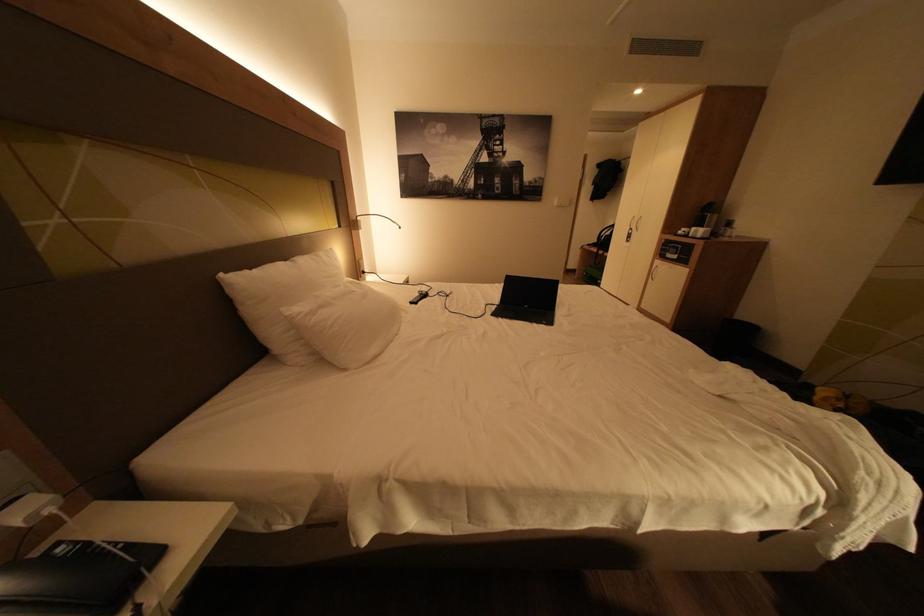
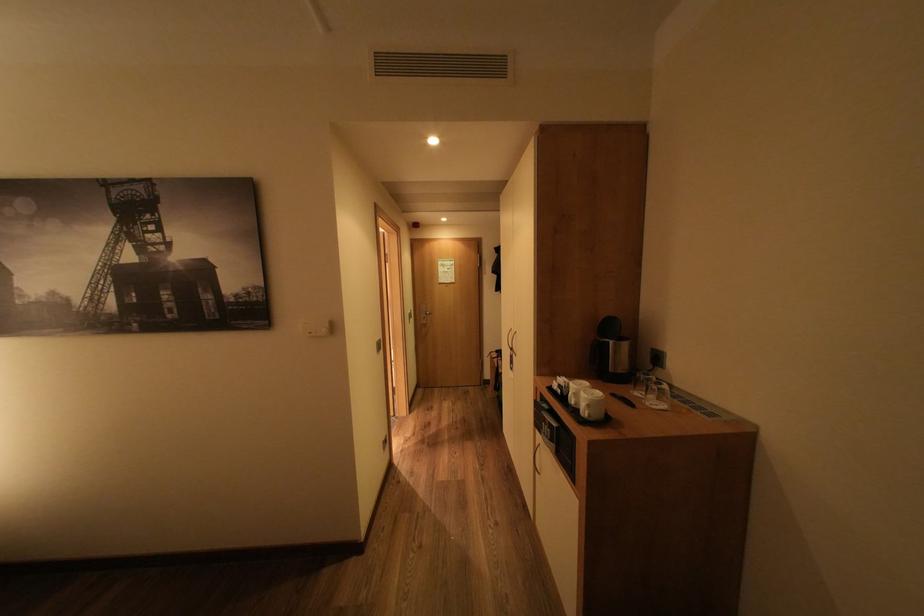
In the second image, find the point that corresponds to point 714,233 in the first image.

(600, 406)